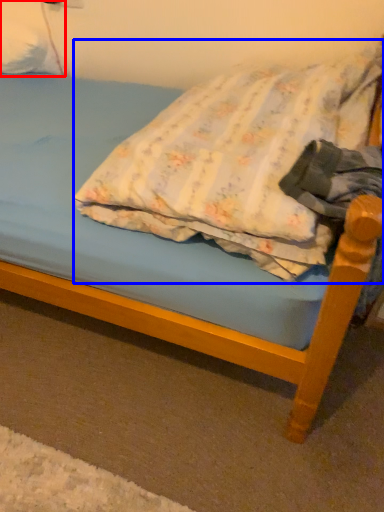
Question: Which of the following is the farthest to the observer, pillow (highlighted by a red box) or pillow (highlighted by a blue box)?

Choices:
 (A) pillow
 (B) pillow

Answer: (A)